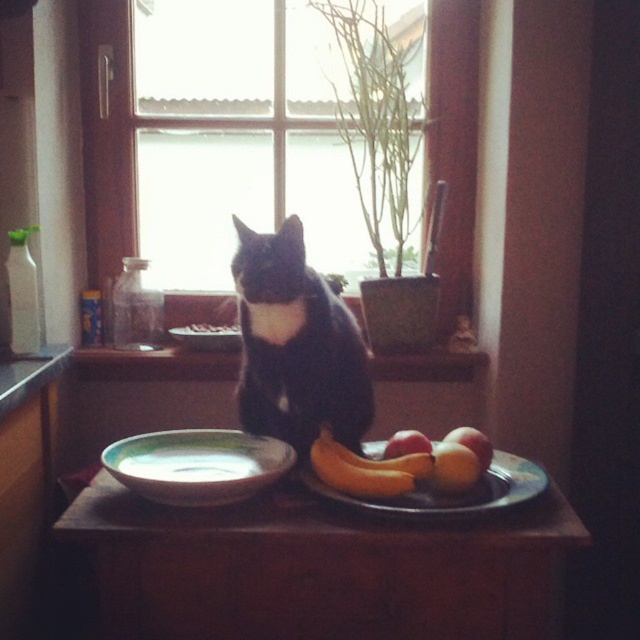
Is point (170, 611) positioned behind point (186, 493)?

Yes, it is behind point (186, 493).

Is wooden table at center to the left of white glossy bowl at lower center from the viewer's perspective?

In fact, wooden table at center is to the right of white glossy bowl at lower center.

Is point (108, 496) behind point (195, 477)?

Yes, point (108, 496) is farther from viewer.

The image size is (640, 640). What are the coordinates of `wooden table at center` in the screenshot? It's located at (323, 566).

Between point (129, 460) and point (456, 380), which one is positioned behind?

The point (456, 380) is more distant.

Between white glossy bowl at lower center and matte wooden window sill at center, which one has less height?

With less height is matte wooden window sill at center.

Is point (134, 484) closer to viewer compared to point (193, 365)?

That is True.

Where is `white glossy bowl at lower center`? The width and height of the screenshot is (640, 640). white glossy bowl at lower center is located at coordinates (196, 465).

Is black fur cat at center closer to camera compared to white glossy bowl at lower center?

No, black fur cat at center is behind white glossy bowl at lower center.

Is black fur cat at center further to the viewer compared to white glossy bowl at lower center?

Yes, black fur cat at center is behind white glossy bowl at lower center.

Is point (292, 349) farther from viewer compared to point (163, 444)?

No.

Locate an element on the screen. black fur cat at center is located at coordinates (296, 346).